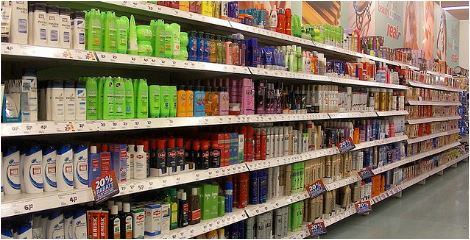
The image size is (470, 240). What are the coordinates of `retailer store shelf` in the screenshot? It's located at (264, 31), (273, 71), (284, 113), (302, 154), (299, 197), (351, 212).